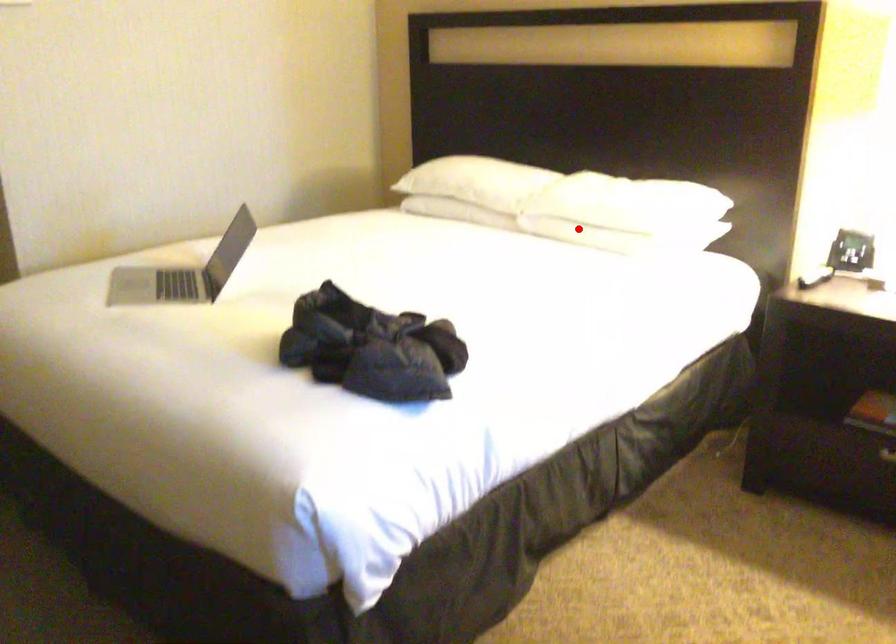
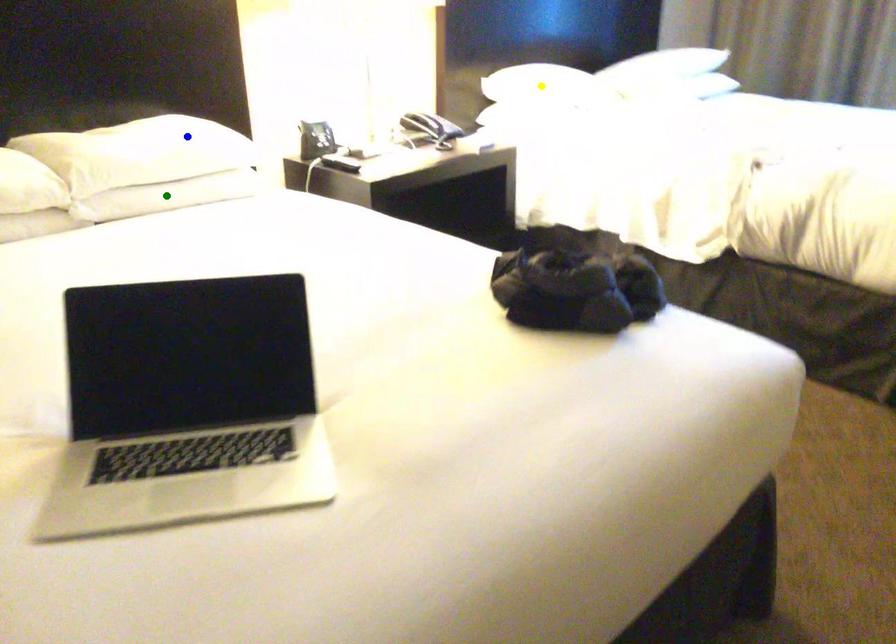
Question: I am providing you with two images of the same scene from different viewpoints. A red point is marked on the first image. You are given multiple points on the second image. Which spot in image 2 lines up with the point in image 1?

Choices:
 (A) yellow point
 (B) green point
 (C) blue point

Answer: (B)